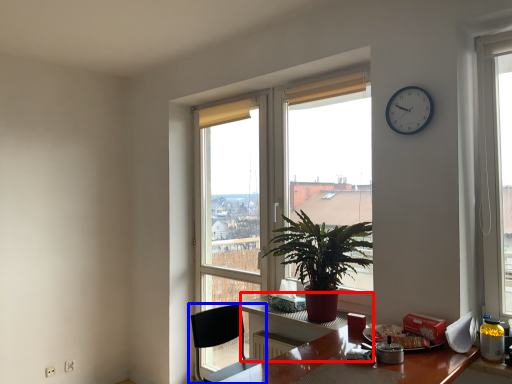
Question: Which object is further to the camera taking this photo, computer desk (highlighted by a red box) or chair (highlighted by a blue box)?

Choices:
 (A) computer desk
 (B) chair

Answer: (A)